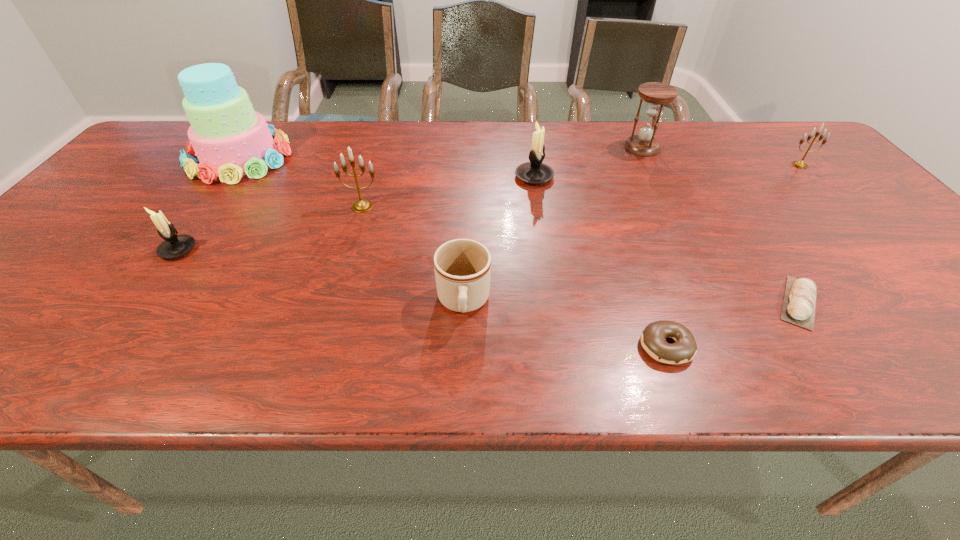
Image resolution: width=960 pixels, height=540 pixels. I want to click on vacant region located on the back of the left white candle holder, so click(x=231, y=174).

Where is `vacant space located on the front of the farther gold candelabrum`? vacant space located on the front of the farther gold candelabrum is located at coordinates (861, 231).

Locate an element on the screen. The height and width of the screenshot is (540, 960). blank area located on the side of the mug with the handle is located at coordinates (461, 372).

Image resolution: width=960 pixels, height=540 pixels. I want to click on vacant space located 0.350m on the back of the sixth object from left to right, so click(619, 213).

This screenshot has width=960, height=540. In order to click on vacant space located on the left of the eighth object from left to right in this screenshot , I will do `click(586, 302)`.

Where is `cake located in the far edge section of the desktop`? The width and height of the screenshot is (960, 540). cake located in the far edge section of the desktop is located at coordinates (230, 139).

Identify the location of hourglass located in the far edge section of the desktop. The image size is (960, 540). (644, 144).

Locate an element on the screen. Image resolution: width=960 pixels, height=540 pixels. candelabrum located at the far edge is located at coordinates (799, 164).

Find the location of a particular element. object at the near edge is located at coordinates (653, 339).

You are a GUI agent. You are given a task and a screenshot of the screen. Output one action in this format:
    pyautogui.click(x=<x>, y=<y>)
    Task: Click on the object at the left edge
    The width and height of the screenshot is (960, 540).
    Given the screenshot: What is the action you would take?
    pyautogui.click(x=230, y=139)